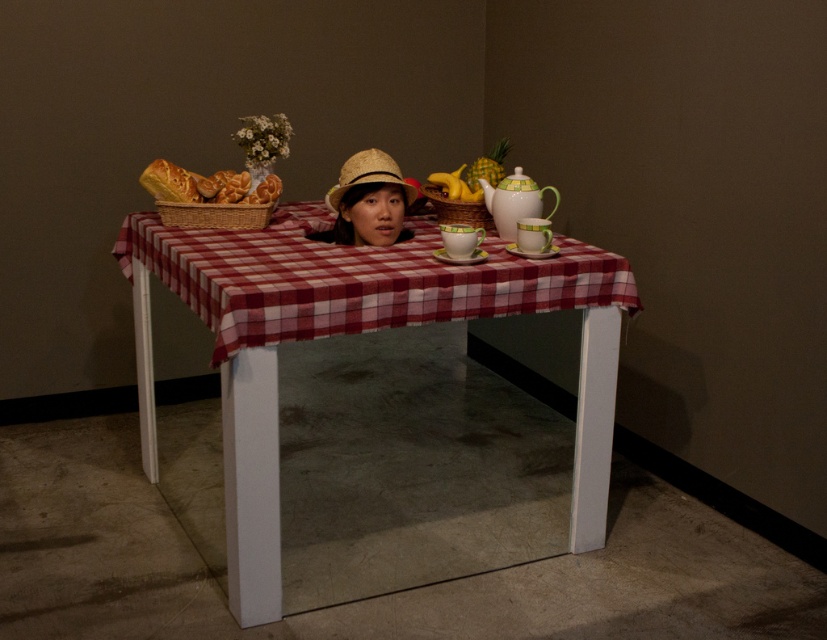
You are standing in front of the table and want to place a small vase with white flowers between the red checkered tablecloth at center and the straw hat at center. Based on their positions, which side of the table should you place the vase on?

The red checkered tablecloth at center is to the right of the straw hat at center. Therefore, you should place the vase to the right of the straw hat at center and to the left of the red checkered tablecloth at center to position it between them.